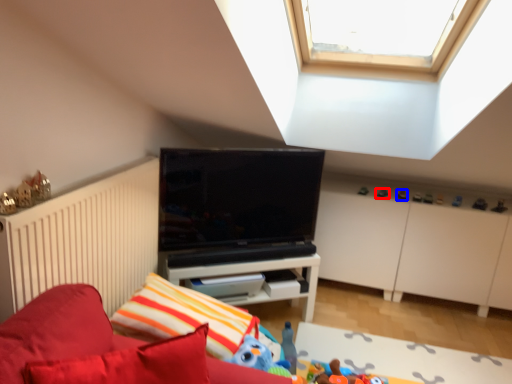
Question: Which object is further to the camera taking this photo, toy (highlighted by a red box) or toy (highlighted by a blue box)?

Choices:
 (A) toy
 (B) toy

Answer: (A)